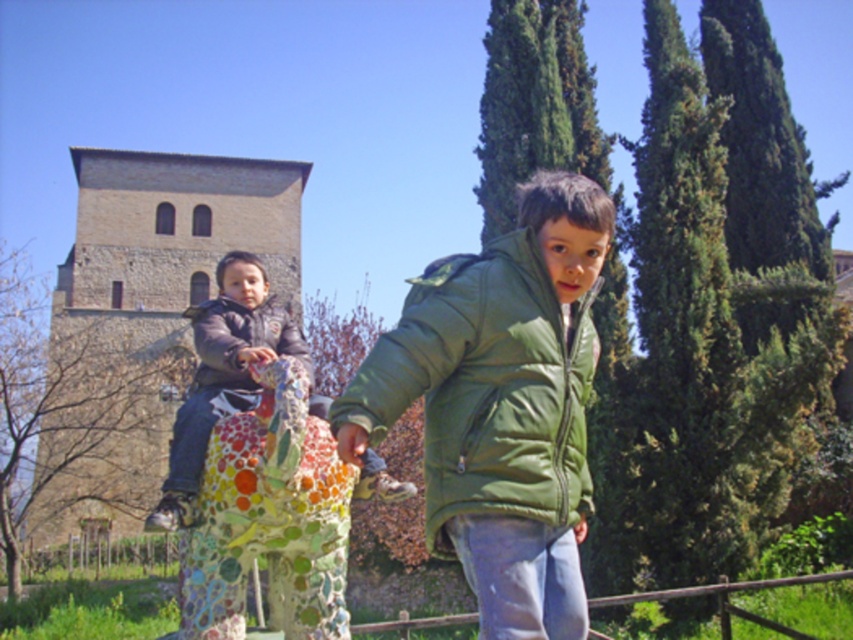
Question: Which of these objects is positioned closest to the matte black jacket at left?

Choices:
 (A) green quilted jacket at center
 (B) dark gray matte jacket at center

Answer: (B)

Question: Is green quilted jacket at center closer to the viewer compared to dark gray matte jacket at center?

Choices:
 (A) yes
 (B) no

Answer: (A)

Question: Is green quilted jacket at center bigger than dark gray matte jacket at center?

Choices:
 (A) no
 (B) yes

Answer: (B)

Question: Which of the following is the closest to the observer?

Choices:
 (A) dark gray matte jacket at center
 (B) matte black jacket at left

Answer: (B)

Question: Is matte black jacket at left positioned before dark gray matte jacket at center?

Choices:
 (A) yes
 (B) no

Answer: (A)

Question: Which object is farther from the camera taking this photo?

Choices:
 (A) matte black jacket at left
 (B) green quilted jacket at center

Answer: (A)